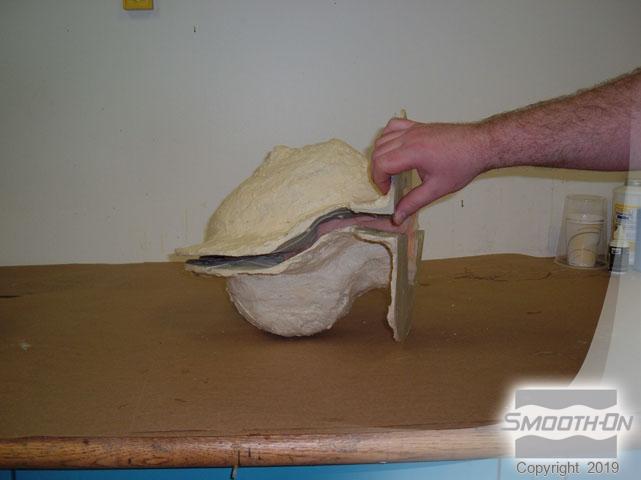
Find the location of a particular element. Image resolution: width=641 pixels, height=480 pixels. wood table/counter top is located at coordinates (195, 362).